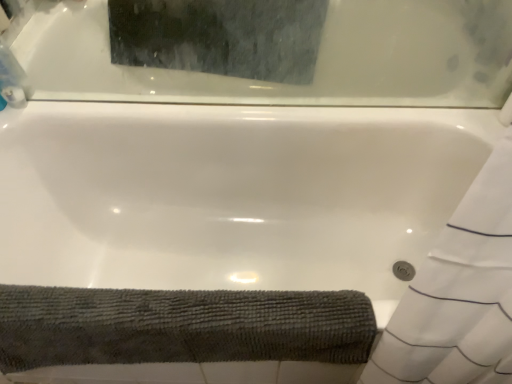
Image resolution: width=512 pixels, height=384 pixels. Find the location of `vacant point above dark gray textured bath towel at lower left (from a real-world perspective)`. vacant point above dark gray textured bath towel at lower left (from a real-world perspective) is located at coordinates (142, 303).